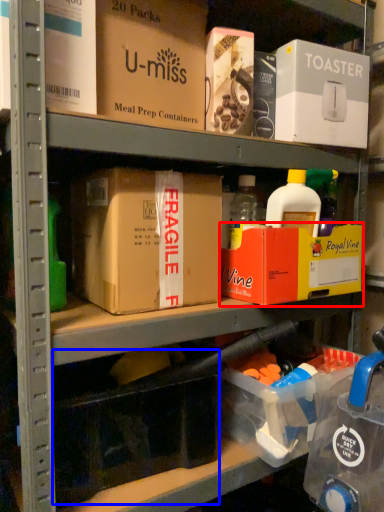
Question: Among these objects, which one is farthest to the camera, box (highlighted by a red box) or storage box (highlighted by a blue box)?

Choices:
 (A) box
 (B) storage box

Answer: (A)